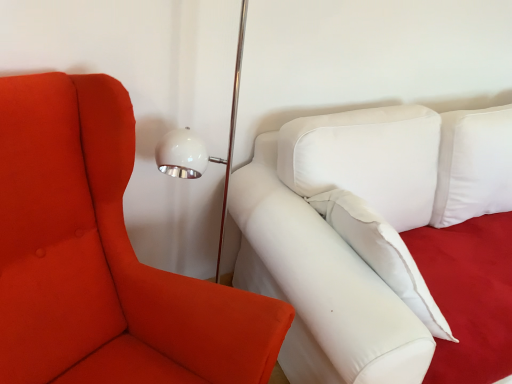
At what (x,y) coordinates should I click in order to perform the action: click on matte orange fabric chair at left. Please return your answer as a coordinate pair (x, y). This screenshot has height=384, width=512. Looking at the image, I should click on (102, 257).

The image size is (512, 384). What do you see at coordinates (102, 257) in the screenshot? I see `matte orange fabric chair at left` at bounding box center [102, 257].

This screenshot has height=384, width=512. Describe the element at coordinates (340, 239) in the screenshot. I see `white fabric studio couch at center` at that location.

Identify the location of white fabric studio couch at center. 340,239.

Find the location of a particular element. matte orange fabric chair at left is located at coordinates (102, 257).

Is matte orange fabric chair at left to the left or to the right of white fabric studio couch at center in the image?

matte orange fabric chair at left is positioned on white fabric studio couch at center's left side.

Is matte orange fabric chair at left closer to the viewer compared to white fabric studio couch at center?

Yes, matte orange fabric chair at left is in front of white fabric studio couch at center.

Which is closer, (46, 356) or (290, 173)?

Point (46, 356) is positioned closer to the camera compared to point (290, 173).

From the image's perspective, which object appears higher, matte orange fabric chair at left or white fabric studio couch at center?

From the image's view, white fabric studio couch at center is above.

From a real-world perspective, which object rests below the other?

In real-world perspective, white fabric studio couch at center is lower.

From the picture: Looking at their sizes, would you say matte orange fabric chair at left is wider or thinner than white fabric studio couch at center?

matte orange fabric chair at left is thinner than white fabric studio couch at center.

Considering the sizes of objects matte orange fabric chair at left and white fabric studio couch at center in the image provided, who is shorter, matte orange fabric chair at left or white fabric studio couch at center?

white fabric studio couch at center is shorter.

Can you confirm if matte orange fabric chair at left is bigger than white fabric studio couch at center?

Actually, matte orange fabric chair at left might be smaller than white fabric studio couch at center.

Based on the photo, would you say white fabric studio couch at center is part of matte orange fabric chair at left's contents?

No, white fabric studio couch at center is located outside of matte orange fabric chair at left.

Is matte orange fabric chair at left next to white fabric studio couch at center and touching it?

There is a gap between matte orange fabric chair at left and white fabric studio couch at center.

Is matte orange fabric chair at left looking in the opposite direction of white fabric studio couch at center?

That's not correct — matte orange fabric chair at left is not looking away from white fabric studio couch at center.

What's the angular difference between matte orange fabric chair at left and white fabric studio couch at center's facing directions?

The facing directions of matte orange fabric chair at left and white fabric studio couch at center are 27.6 degrees apart.

Find the location of a particular element. studio couch that is under the matte orange fabric chair at left (from a real-world perspective) is located at coordinates (340, 239).

Considering the relative positions of white fabric studio couch at center and matte orange fabric chair at left in the image provided, is white fabric studio couch at center to the left or to the right of matte orange fabric chair at left?

From the image, it's evident that white fabric studio couch at center is to the right of matte orange fabric chair at left.

Which is in front, white fabric studio couch at center or matte orange fabric chair at left?

matte orange fabric chair at left is closer to the camera.

Is point (374, 320) less distant than point (25, 152)?

No, (374, 320) is behind (25, 152).

From the image's perspective, is white fabric studio couch at center located above matte orange fabric chair at left?

Correct, white fabric studio couch at center appears higher than matte orange fabric chair at left in the image.

From the picture: From a real-world perspective, does white fabric studio couch at center stand above matte orange fabric chair at left?

No, from a real-world perspective, white fabric studio couch at center is not on top of matte orange fabric chair at left.

Is white fabric studio couch at center wider than matte orange fabric chair at left?

Correct, the width of white fabric studio couch at center exceeds that of matte orange fabric chair at left.

Which of these two, white fabric studio couch at center or matte orange fabric chair at left, stands shorter?

white fabric studio couch at center is shorter.

Does white fabric studio couch at center have a larger size compared to matte orange fabric chair at left?

Correct, white fabric studio couch at center is larger in size than matte orange fabric chair at left.

Is matte orange fabric chair at left completely or partially inside white fabric studio couch at center?

No, matte orange fabric chair at left is located outside of white fabric studio couch at center.

Based on the photo, can you see white fabric studio couch at center touching matte orange fabric chair at left?

No, white fabric studio couch at center is not making contact with matte orange fabric chair at left.

Is white fabric studio couch at center turned away from matte orange fabric chair at left?

No, white fabric studio couch at center is not facing the opposite direction of matte orange fabric chair at left.

How far apart are white fabric studio couch at center and matte orange fabric chair at left?

white fabric studio couch at center and matte orange fabric chair at left are 20.60 inches apart from each other.

The width and height of the screenshot is (512, 384). I want to click on studio couch on the right of the matte orange fabric chair at left, so click(x=340, y=239).

Find the location of `studio couch located above the matte orange fabric chair at left (from the image's perspective)`. studio couch located above the matte orange fabric chair at left (from the image's perspective) is located at coordinates (340, 239).

You are a GUI agent. You are given a task and a screenshot of the screen. Output one action in this format:
    pyautogui.click(x=<x>, y=<y>)
    Task: Click on the studio couch on the right of matte orange fabric chair at left
    This screenshot has height=384, width=512.
    Given the screenshot: What is the action you would take?
    pyautogui.click(x=340, y=239)